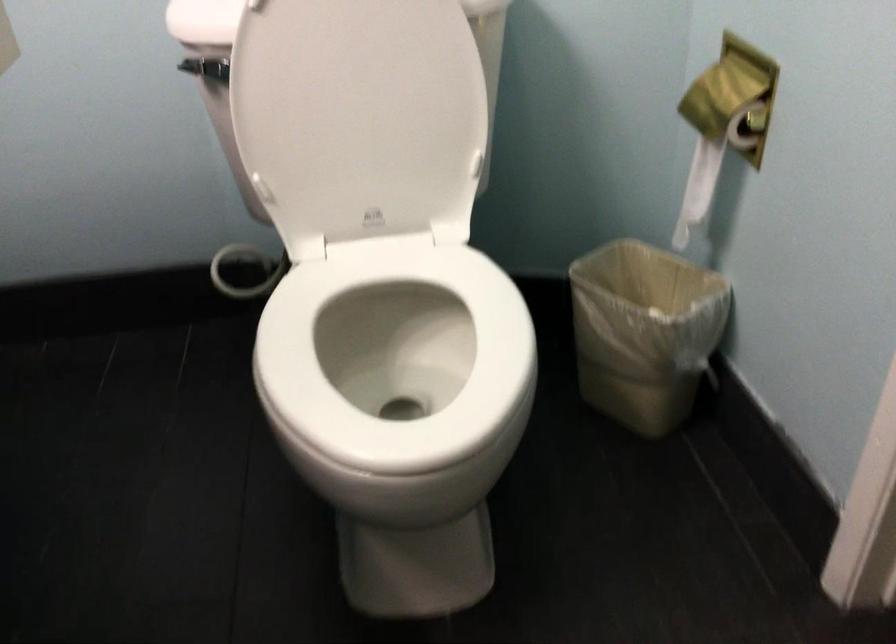
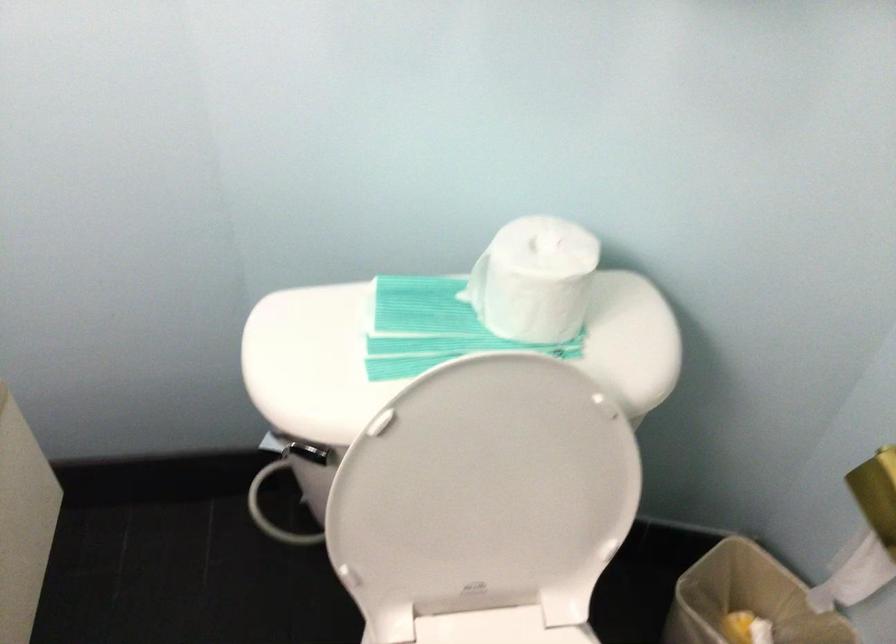
Where in the second image is the point corresponding to [694,143] from the first image?

(866, 534)